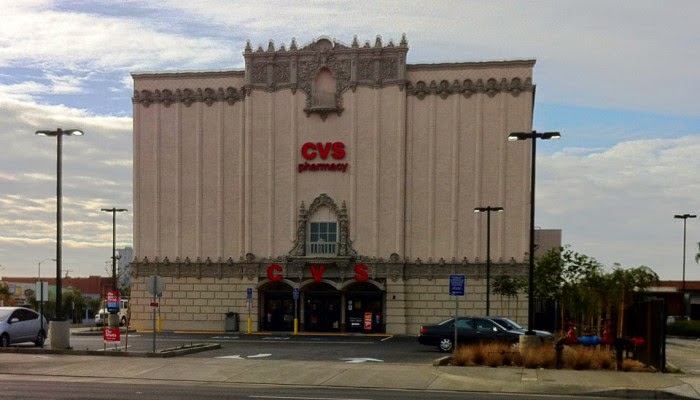
The width and height of the screenshot is (700, 400). What are the coordinates of `triple black doors` in the screenshot? It's located at (321, 302), (281, 305), (367, 311).